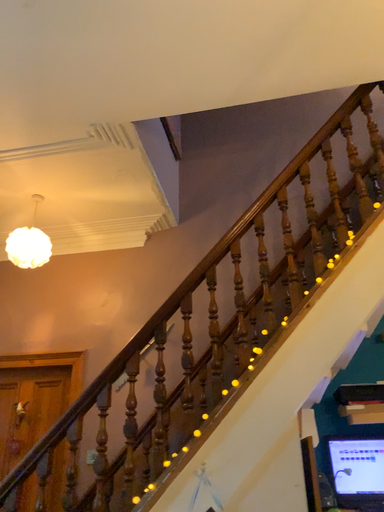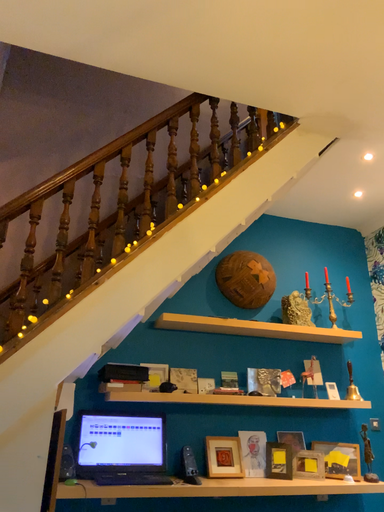
Question: Which way did the camera rotate in the video?

Choices:
 (A) rotated right
 (B) rotated left

Answer: (A)